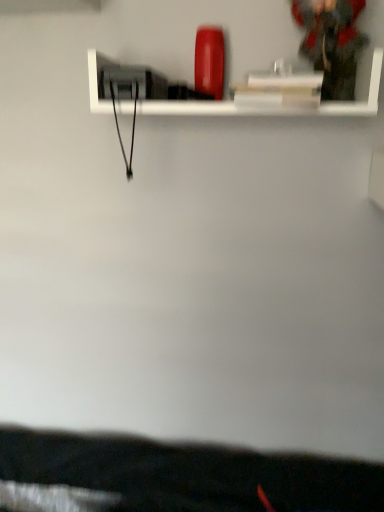
Identify the location of white glossy shelf at upper center. Image resolution: width=384 pixels, height=512 pixels. (202, 109).

This screenshot has height=512, width=384. What do you see at coordinates (202, 109) in the screenshot?
I see `white glossy shelf at upper center` at bounding box center [202, 109].

Describe the element at coordinates (331, 42) in the screenshot. I see `dark gray fabric jacket at upper right` at that location.

This screenshot has height=512, width=384. Identify the location of dark gray fabric jacket at upper right. (331, 42).

Measure the distance between dark gray fabric jacket at upper right and camera.

dark gray fabric jacket at upper right and camera are 33.88 inches apart from each other.

Where is `white glossy shelf at upper center`? white glossy shelf at upper center is located at coordinates (202, 109).

Does white glossy shelf at upper center appear on the left side of dark gray fabric jacket at upper right?

Indeed, white glossy shelf at upper center is positioned on the left side of dark gray fabric jacket at upper right.

Which is behind, white glossy shelf at upper center or dark gray fabric jacket at upper right?

dark gray fabric jacket at upper right is behind.

Is point (166, 106) closer to viewer compared to point (318, 8)?

No, it is behind (318, 8).

From the image's perspective, relative to dark gray fabric jacket at upper right, is white glossy shelf at upper center above or below?

Based on their image positions, white glossy shelf at upper center is located beneath dark gray fabric jacket at upper right.

From a real-world perspective, who is located higher, white glossy shelf at upper center or dark gray fabric jacket at upper right?

In real-world perspective, dark gray fabric jacket at upper right is above.

Which of these two, white glossy shelf at upper center or dark gray fabric jacket at upper right, is wider?

white glossy shelf at upper center is wider.

Who is taller, white glossy shelf at upper center or dark gray fabric jacket at upper right?

Standing taller between the two is dark gray fabric jacket at upper right.

Is white glossy shelf at upper center smaller than dark gray fabric jacket at upper right?

Incorrect, white glossy shelf at upper center is not smaller in size than dark gray fabric jacket at upper right.

Is white glossy shelf at upper center inside the boundaries of dark gray fabric jacket at upper right, or outside?

white glossy shelf at upper center lies outside dark gray fabric jacket at upper right.

Is white glossy shelf at upper center with dark gray fabric jacket at upper right?

No, white glossy shelf at upper center is not beside dark gray fabric jacket at upper right.

Could you tell me if white glossy shelf at upper center is turned towards dark gray fabric jacket at upper right?

No, white glossy shelf at upper center is not facing towards dark gray fabric jacket at upper right.

Where is `shelf on the left side of dark gray fabric jacket at upper right`? The width and height of the screenshot is (384, 512). shelf on the left side of dark gray fabric jacket at upper right is located at coordinates (202, 109).

Considering the relative positions of dark gray fabric jacket at upper right and white glossy shelf at upper center in the image provided, is dark gray fabric jacket at upper right to the left or to the right of white glossy shelf at upper center?

dark gray fabric jacket at upper right is to the right of white glossy shelf at upper center.

Is dark gray fabric jacket at upper right further to camera compared to white glossy shelf at upper center?

That is True.

Considering the positions of point (322, 96) and point (353, 108), is point (322, 96) closer or farther from the camera than point (353, 108)?

Point (322, 96) is farther from the camera than point (353, 108).

From the image's perspective, which one is positioned higher, dark gray fabric jacket at upper right or white glossy shelf at upper center?

dark gray fabric jacket at upper right is shown above in the image.

From a real-world perspective, is dark gray fabric jacket at upper right on top of white glossy shelf at upper center?

Yes, from a real-world perspective, dark gray fabric jacket at upper right is over white glossy shelf at upper center

Considering the sizes of dark gray fabric jacket at upper right and white glossy shelf at upper center in the image, is dark gray fabric jacket at upper right wider or thinner than white glossy shelf at upper center?

Clearly, dark gray fabric jacket at upper right has less width compared to white glossy shelf at upper center.

Looking at this image, can you confirm if dark gray fabric jacket at upper right is taller than white glossy shelf at upper center?

Indeed, dark gray fabric jacket at upper right has a greater height compared to white glossy shelf at upper center.

Is dark gray fabric jacket at upper right bigger than white glossy shelf at upper center?

No.

Choose the correct answer: Is dark gray fabric jacket at upper right inside white glossy shelf at upper center or outside it?

dark gray fabric jacket at upper right can be found inside white glossy shelf at upper center.

Is dark gray fabric jacket at upper right beside white glossy shelf at upper center?

dark gray fabric jacket at upper right and white glossy shelf at upper center are clearly separated.

Could you tell me if dark gray fabric jacket at upper right is facing white glossy shelf at upper center?

No, dark gray fabric jacket at upper right does not turn towards white glossy shelf at upper center.

What's the angular difference between dark gray fabric jacket at upper right and white glossy shelf at upper center's facing directions?

dark gray fabric jacket at upper right and white glossy shelf at upper center are facing 0.293 degrees away from each other.

You are a GUI agent. You are given a task and a screenshot of the screen. Output one action in this format:
    pyautogui.click(x=<x>, y=<y>)
    Task: Click on the person behind the white glossy shelf at upper center
    
    Given the screenshot: What is the action you would take?
    pyautogui.click(x=331, y=42)

At what (x,y) coordinates should I click in order to perform the action: click on person above the white glossy shelf at upper center (from the image's perspective). Please return your answer as a coordinate pair (x, y). Image resolution: width=384 pixels, height=512 pixels. Looking at the image, I should click on (331, 42).

Where is `person that is behind the white glossy shelf at upper center`? The height and width of the screenshot is (512, 384). person that is behind the white glossy shelf at upper center is located at coordinates (331, 42).